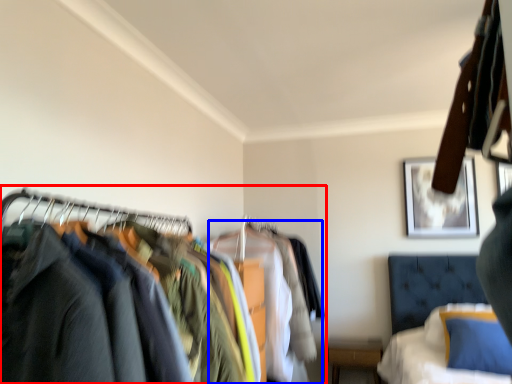
Question: Among these objects, which one is nearest to the camera, closet (highlighted by a red box) or clothing (highlighted by a blue box)?

Choices:
 (A) closet
 (B) clothing

Answer: (A)